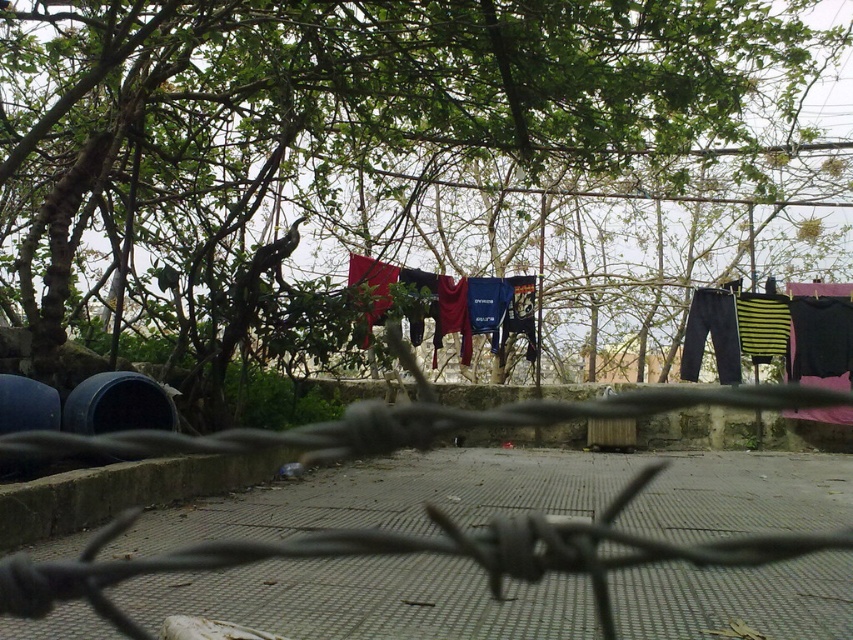
Question: Which object is positioned farthest from the green leafy tree at upper center?

Choices:
 (A) red fabric clothes at center
 (B) barbed wire at center

Answer: (B)

Question: From the image, what is the correct spatial relationship of green leafy tree at upper center in relation to red fabric clothes at center?

Choices:
 (A) above
 (B) below

Answer: (A)

Question: Among these objects, which one is farthest from the camera?

Choices:
 (A) barbed wire at center
 (B) red fabric clothes at center

Answer: (B)

Question: Does barbed wire at center lie in front of red fabric clothes at center?

Choices:
 (A) yes
 (B) no

Answer: (A)

Question: Is barbed wire at center bigger than red fabric clothes at center?

Choices:
 (A) no
 (B) yes

Answer: (B)

Question: Which is nearer to the red fabric clothes at center?

Choices:
 (A) barbed wire at center
 (B) green leafy tree at upper center

Answer: (A)